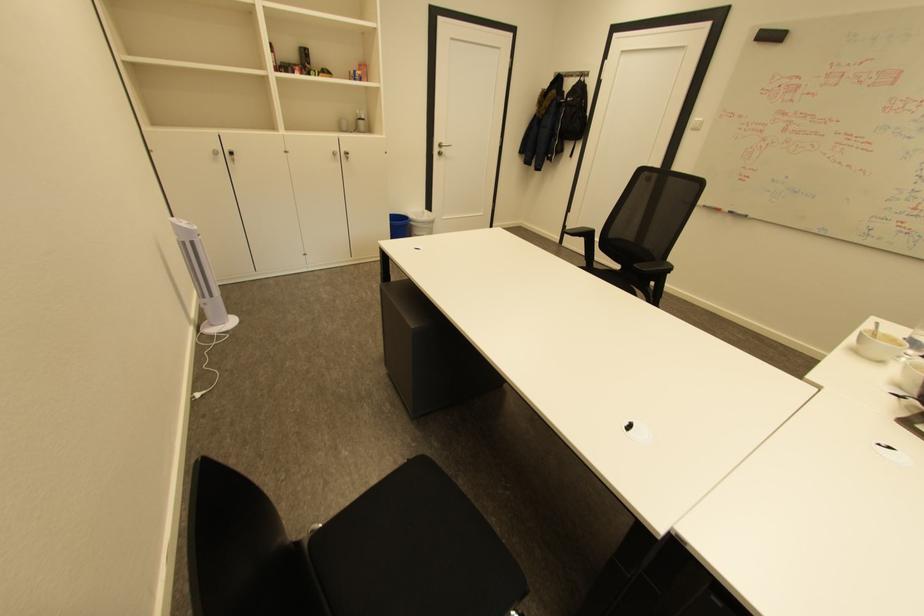
The height and width of the screenshot is (616, 924). I want to click on white ceramic bowl, so click(878, 345).